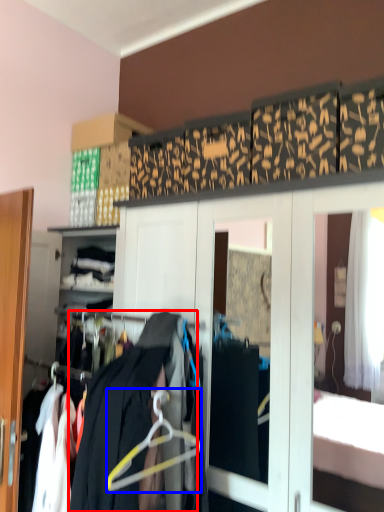
Question: Which object appears closest to the camera in this image, clothing (highlighted by a red box) or hanger (highlighted by a blue box)?

Choices:
 (A) clothing
 (B) hanger

Answer: (A)